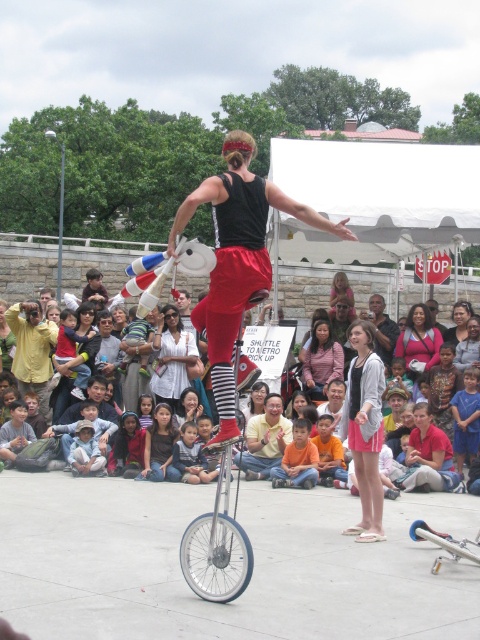
Question: Can you confirm if pink fabric skirt at center is positioned to the left of white shirt at center?

Choices:
 (A) yes
 (B) no

Answer: (B)

Question: Which of the following is the closest to the observer?

Choices:
 (A) (356, 474)
 (B) (243, 461)
 (C) (32, 360)
 (D) (394, 282)

Answer: (A)

Question: Among these points, which one is nearest to the camera?

Choices:
 (A) (157, 353)
 (B) (309, 381)

Answer: (B)

Question: From the image, what is the correct spatial relationship of matte black unicycle at center in relation to yellow cotton shirt at lower left?

Choices:
 (A) above
 (B) below

Answer: (A)

Question: Is matte white shirt at center to the left of matte black shirt at center from the viewer's perspective?

Choices:
 (A) no
 (B) yes

Answer: (B)

Question: Which point is farther from the camera taking this photo?

Choices:
 (A) (186, 380)
 (B) (370, 280)
 (C) (324, 381)

Answer: (B)